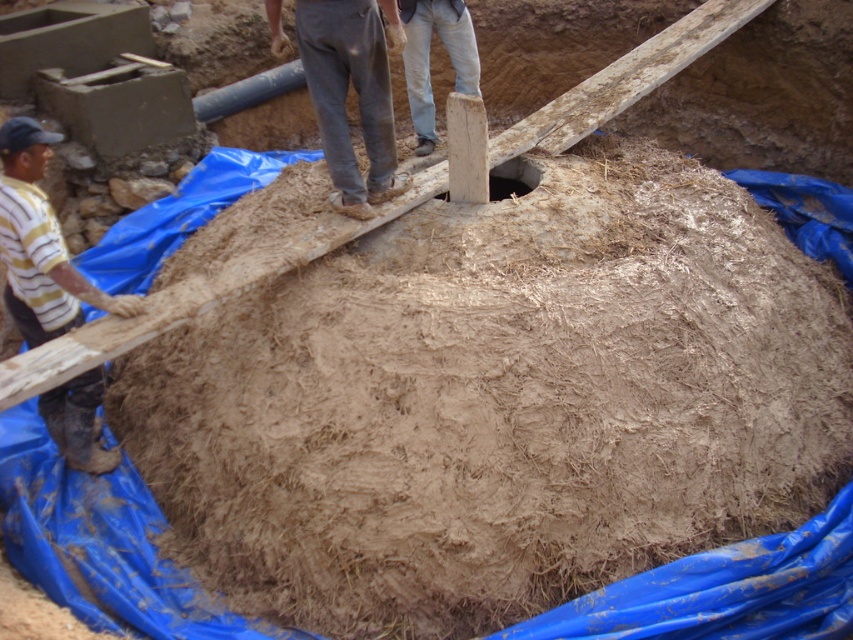
Which is behind, point (270, 17) or point (442, 196)?

The point (442, 196) is behind.

The width and height of the screenshot is (853, 640). What do you see at coordinates (355, 92) in the screenshot?
I see `gray cotton pants at center` at bounding box center [355, 92].

Find the location of a particular element. The image size is (853, 640). gray cotton pants at center is located at coordinates (355, 92).

Image resolution: width=853 pixels, height=640 pixels. Find the location of `light beige jeans at upper center`. light beige jeans at upper center is located at coordinates (428, 58).

Is light beige jeans at upper center below brown dirt hole at center?

Actually, light beige jeans at upper center is above brown dirt hole at center.

Is point (421, 10) in front of point (489, 192)?

No, it is behind (489, 192).

The image size is (853, 640). Identify the location of light beige jeans at upper center. (428, 58).

Does point (7, 202) lie behind point (323, 67)?

That is False.

Who is taller, dirty yellow shirt at left or gray cotton pants at center?

With more height is dirty yellow shirt at left.

Which is in front, point (16, 278) or point (370, 204)?

Point (16, 278) is more forward.

This screenshot has height=640, width=853. Identify the location of dirty yellow shirt at left. (39, 243).